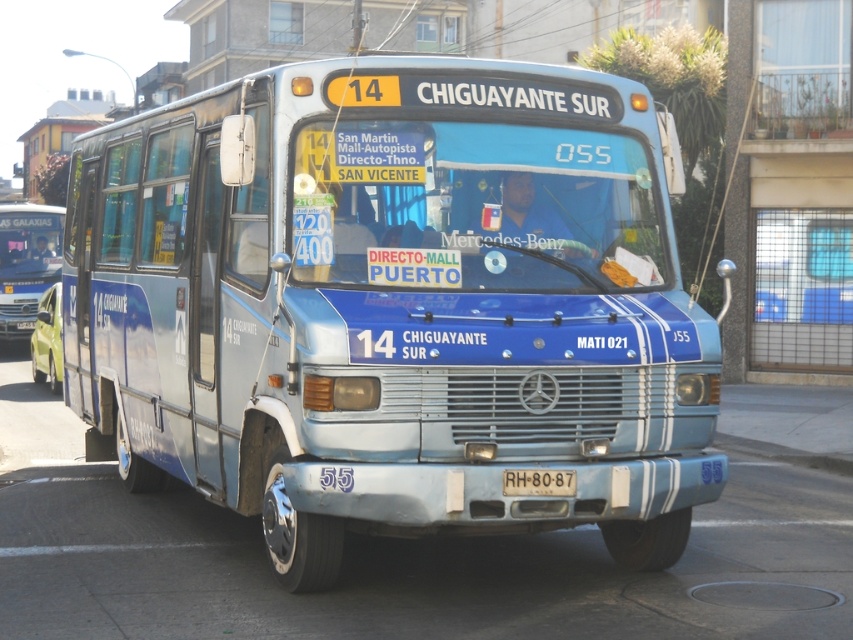
You are a photographer trying to capture the entire blue metallic bus at center in your shot. However, you notice the white plastic license plate at center might be blocking part of the bus. Is the license plate too big to avoid overlapping with the bus?

The blue metallic bus at center has a larger size compared to the white plastic license plate at center, so the license plate is small enough and unlikely to block a significant portion of the bus in your photo.

Consider the image. You are standing at the intersection and see the blue metallic bus at center. What is the exact location of the point with coordinates (x=392, y=305)?

The point with coordinates (x=392, y=305) corresponds to the blue metallic bus at center.